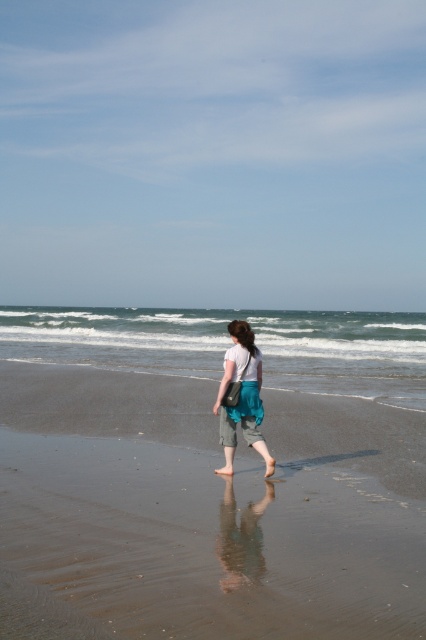
Is brown sand at lower center to the right of teal fabric skirt at center from the viewer's perspective?

Incorrect, brown sand at lower center is not on the right side of teal fabric skirt at center.

Image resolution: width=426 pixels, height=640 pixels. What do you see at coordinates (209, 509) in the screenshot?
I see `brown sand at lower center` at bounding box center [209, 509].

Where is `brown sand at lower center`? The width and height of the screenshot is (426, 640). brown sand at lower center is located at coordinates (209, 509).

Between brown sand at lower center and greenish-blue water at center, which one is positioned higher?

greenish-blue water at center is above.

Does brown sand at lower center have a greater width compared to greenish-blue water at center?

Incorrect, brown sand at lower center's width does not surpass greenish-blue water at center's.

Does point (310, 620) come closer to viewer compared to point (331, 385)?

Yes, point (310, 620) is in front of point (331, 385).

At what (x,y) coordinates should I click in order to perform the action: click on brown sand at lower center. Please return your answer as a coordinate pair (x, y). Image resolution: width=426 pixels, height=640 pixels. Looking at the image, I should click on (209, 509).

Is greenish-blue water at center further to camera compared to teal fabric skirt at center?

Yes, greenish-blue water at center is further from the viewer.

Can you confirm if greenish-blue water at center is smaller than teal fabric skirt at center?

No, greenish-blue water at center is not smaller than teal fabric skirt at center.

Image resolution: width=426 pixels, height=640 pixels. What do you see at coordinates (230, 342) in the screenshot?
I see `greenish-blue water at center` at bounding box center [230, 342].

What are the coordinates of `greenish-blue water at center` in the screenshot? It's located at (230, 342).